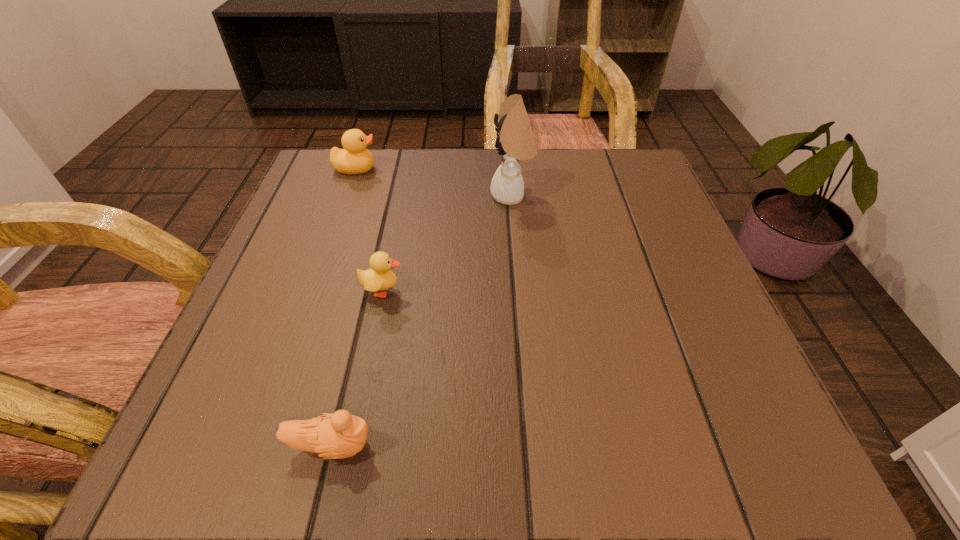
The height and width of the screenshot is (540, 960). I want to click on empty location between the nearest duckling and the rightmost object, so click(x=421, y=320).

At what (x,y) coordinates should I click in order to perform the action: click on empty location between the rightmost object and the second farthest duckling. Please return your answer as a coordinate pair (x, y). Image resolution: width=960 pixels, height=540 pixels. Looking at the image, I should click on (447, 243).

This screenshot has width=960, height=540. Find the location of `vacant space that is in between the rightmost object and the farthest duckling`. vacant space that is in between the rightmost object and the farthest duckling is located at coordinates (434, 182).

This screenshot has height=540, width=960. In order to click on the third closest object to the nearest duckling in this screenshot , I will do (354, 159).

Point out which object is positioned as the second nearest to the doll. Please provide its 2D coordinates. Your answer should be formatted as a tuple, i.e. [(x, y)], where the tuple contains the x and y coordinates of a point satisfying the conditions above.

[(354, 159)]

Where is `duckling that is the closest to the doll`? The image size is (960, 540). duckling that is the closest to the doll is located at coordinates (378, 278).

Identify the location of the second closest duckling to the third farthest object. (354, 159).